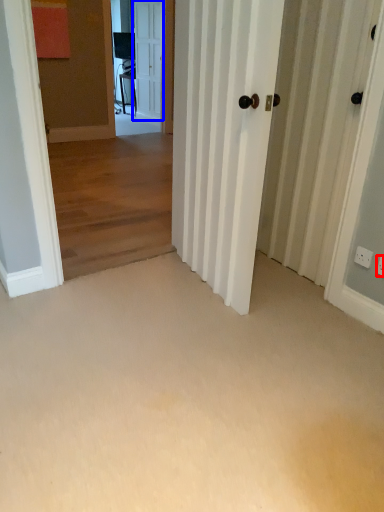
Question: Which object is further to the camera taking this photo, electric outlet (highlighted by a red box) or door (highlighted by a blue box)?

Choices:
 (A) electric outlet
 (B) door

Answer: (B)